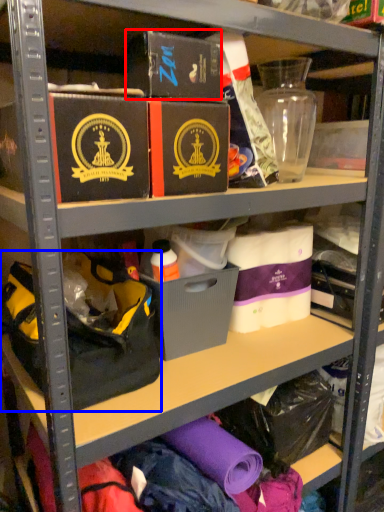
Question: Which point is closer to the camera, box (highlighted by a red box) or handbag (highlighted by a blue box)?

Choices:
 (A) box
 (B) handbag

Answer: (A)